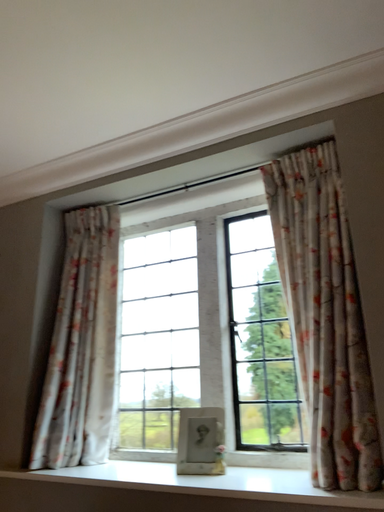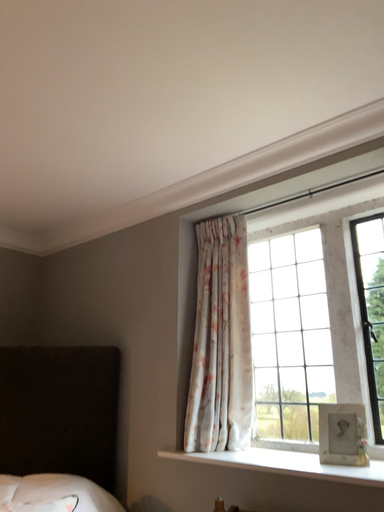
Question: Which way did the camera rotate in the video?

Choices:
 (A) rotated right
 (B) rotated left

Answer: (B)